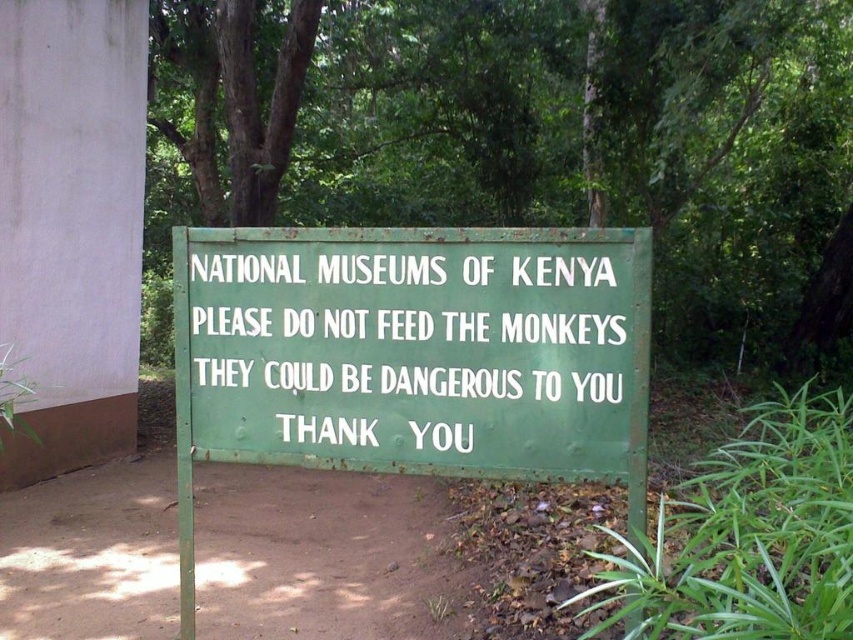
Question: From the image, what is the correct spatial relationship of green metal sign at center in relation to green painted metal signboard at center?

Choices:
 (A) left
 (B) right

Answer: (A)

Question: Observing the image, what is the correct spatial positioning of green wooden signboard at center in reference to green painted metal signboard at center?

Choices:
 (A) right
 (B) left

Answer: (A)

Question: Among these objects, which one is farthest from the camera?

Choices:
 (A) green wooden signboard at center
 (B) green painted metal signboard at center

Answer: (A)

Question: Which point is closer to the camera?

Choices:
 (A) (473, 342)
 (B) (199, 308)
 (C) (605, 45)

Answer: (A)

Question: Among these objects, which one is nearest to the camera?

Choices:
 (A) green painted metal signboard at center
 (B) green wooden signboard at center
 (C) green metal sign at center

Answer: (C)

Question: Where is green metal sign at center located in relation to green painted metal signboard at center in the image?

Choices:
 (A) above
 (B) below

Answer: (B)